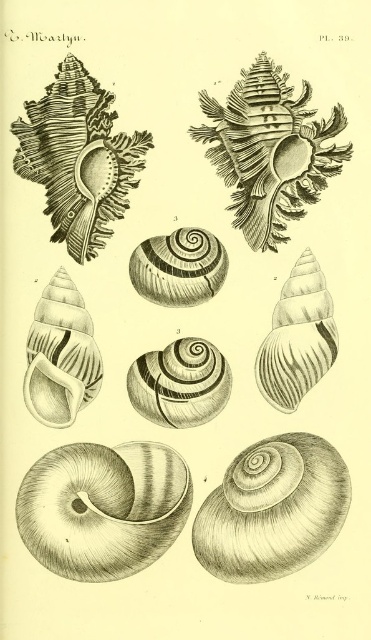
Question: Does smooth brown shell at upper center appear on the right side of striped shell at center?

Choices:
 (A) yes
 (B) no

Answer: (A)

Question: Which point is farther from the camera taking this photo?

Choices:
 (A) (274, 157)
 (B) (155, 298)
 (C) (211, 390)
 (D) (125, 467)

Answer: (B)

Question: Considering the relative positions of matte white shell at center-left and smooth white shell at center right in the image provided, where is matte white shell at center-left located with respect to smooth white shell at center right?

Choices:
 (A) above
 (B) below

Answer: (B)

Question: Which object appears farthest from the camera in this image?

Choices:
 (A) striped shell at center
 (B) smooth brown shell at upper center
 (C) smooth brown shell at bottom left
 (D) smooth black shell at upper left

Answer: (A)

Question: Does smooth brown shell at bottom left have a larger size compared to spiral shell at center?

Choices:
 (A) no
 (B) yes

Answer: (B)

Question: Which object is closer to the camera taking this photo?

Choices:
 (A) smooth black shell at upper left
 (B) matte white shell at center-left
 (C) smooth white shell at center right

Answer: (A)